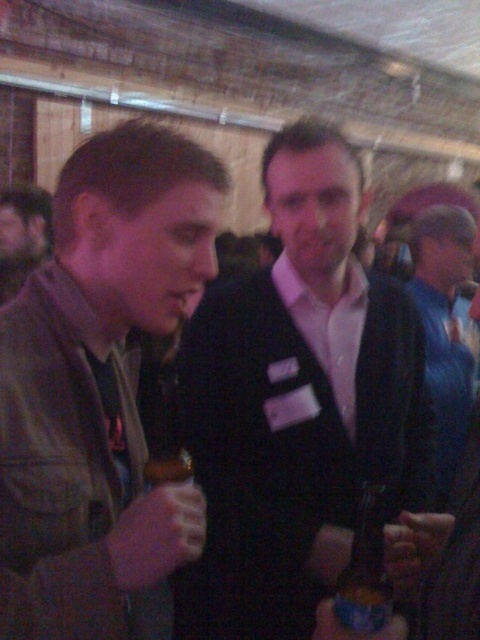
You are organizing a photo shoot and need to arrange the black matte suit at center and the leather jacket at left based on their sizes. Which jacket should be placed first if you want to arrange them from largest to smallest?

The black matte suit at center should be placed first because it has a larger size compared to the leather jacket at left.